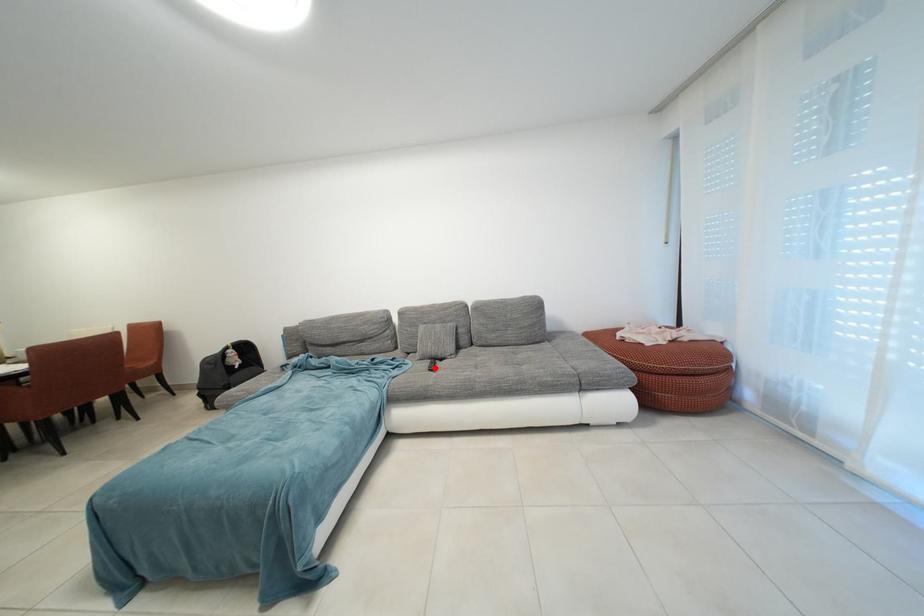
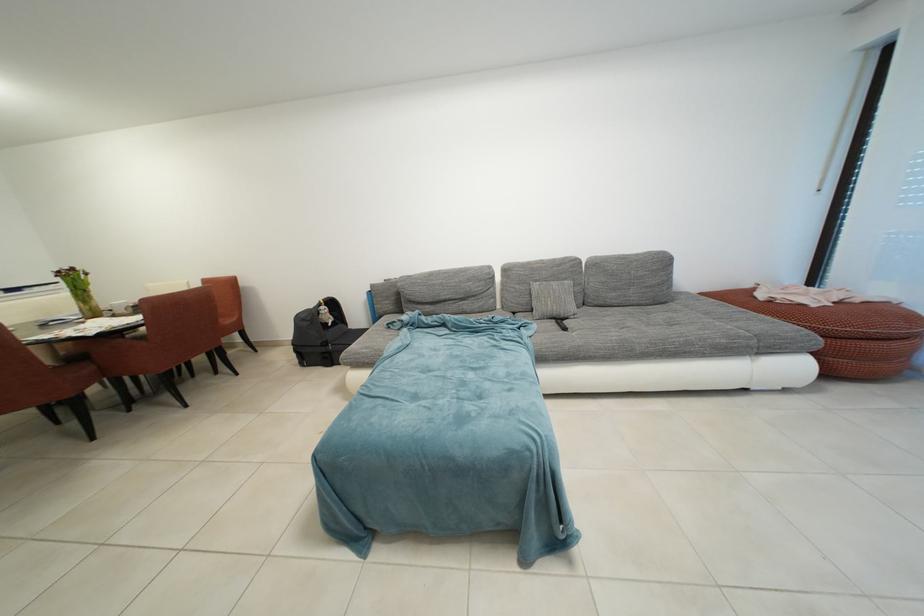
Question: I am providing you with two images of the same scene from different viewpoints. A red point is marked on the first image. At the location where the point appears in image 1, is it still visible in image 2?

Choices:
 (A) Yes
 (B) No

Answer: (A)